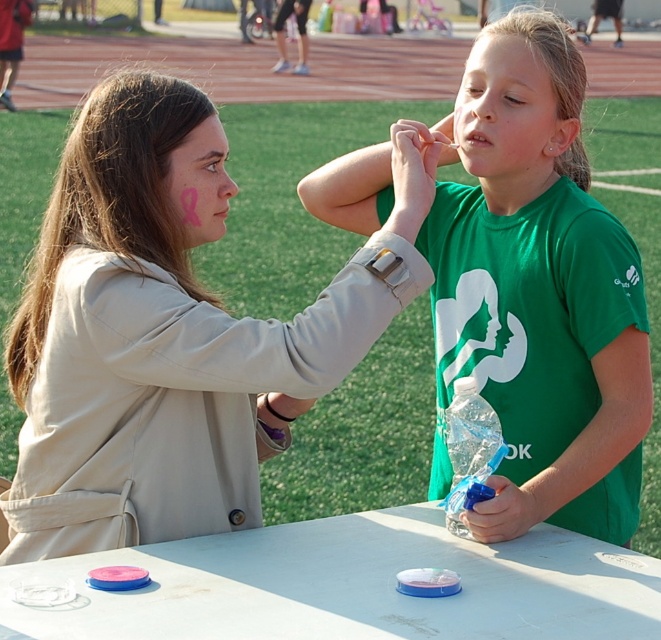
Does matte green shirt at center have a greater height compared to pink matte ribbon at left?

Indeed, matte green shirt at center has a greater height compared to pink matte ribbon at left.

Does point (524, 106) come closer to viewer compared to point (176, 198)?

No, (524, 106) is further to viewer.

Is point (525, 168) behind point (217, 204)?

Yes, it is.

Where is `matte green shirt at center`? matte green shirt at center is located at coordinates pos(508,113).

Can you confirm if matte green shirt at center is positioned to the left of pink matte face paint at upper center?

Indeed, matte green shirt at center is positioned on the left side of pink matte face paint at upper center.

Is matte green shirt at center further to camera compared to pink matte face paint at upper center?

No, it is in front of pink matte face paint at upper center.

At what (x,y) coordinates should I click in order to perform the action: click on matte green shirt at center. Please return your answer as a coordinate pair (x, y). Looking at the image, I should click on (508, 113).

At what (x,y) coordinates should I click in order to perform the action: click on matte green shirt at center. Please return your answer as a coordinate pair (x, y). The image size is (661, 640). Looking at the image, I should click on (508, 113).

Can you confirm if matte beige jacket at upper left is positioned to the right of white plastic picnic table at center?

Incorrect, matte beige jacket at upper left is not on the right side of white plastic picnic table at center.

Can you confirm if matte beige jacket at upper left is wider than white plastic picnic table at center?

Incorrect, matte beige jacket at upper left's width does not surpass white plastic picnic table at center's.

The image size is (661, 640). What are the coordinates of `matte beige jacket at upper left` in the screenshot? It's located at (169, 340).

The height and width of the screenshot is (640, 661). Find the location of `matte beige jacket at upper left`. matte beige jacket at upper left is located at coordinates (169, 340).